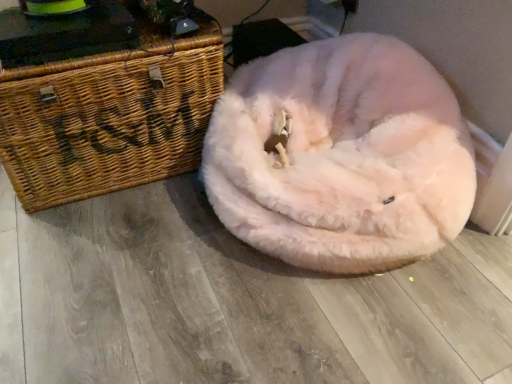
Identify the location of free space that is in between woven wood chest at left and fluffy pink dog bed at center. (155, 246).